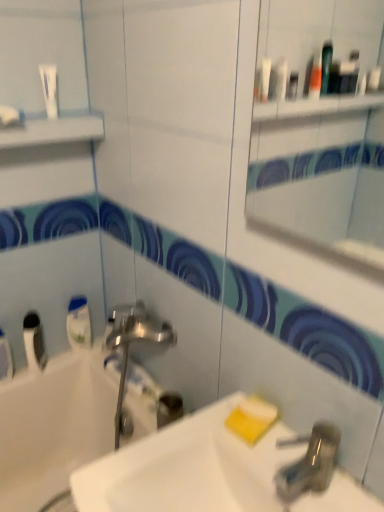
Question: From a real-world perspective, is white glossy sink at center positioned above or below white glossy bathtub at lower left?

Choices:
 (A) above
 (B) below

Answer: (A)

Question: In terms of width, does white glossy sink at center look wider or thinner when compared to white glossy bathtub at lower left?

Choices:
 (A) thin
 (B) wide

Answer: (A)

Question: Estimate the real-world distances between objects in this image. Which object is farther from the white opaque tube at lower left, arranged as the 1th mouthwash when viewed from the left?

Choices:
 (A) white glossy bathtub at lower left
 (B) yellow matte soap at lower right, placed as the first soap when sorted from top to bottom
 (C) metallic faucet at lower right
 (D) white glossy tube at upper left
 (E) white glossy mouthwash at left, the 1th mouthwash in the right-to-left sequence

Answer: (C)

Question: Which object is positioned closest to the yellow matte soap at lower right, which is counted as the 2th soap, starting from the bottom?

Choices:
 (A) white opaque tube at lower left, which appears as the second mouthwash when viewed from the right
 (B) metallic faucet at lower right
 (C) white glossy sink at center
 (D) white glossy mouthwash at left, the 1th mouthwash in the right-to-left sequence
 (E) white glossy bathtub at lower left

Answer: (B)